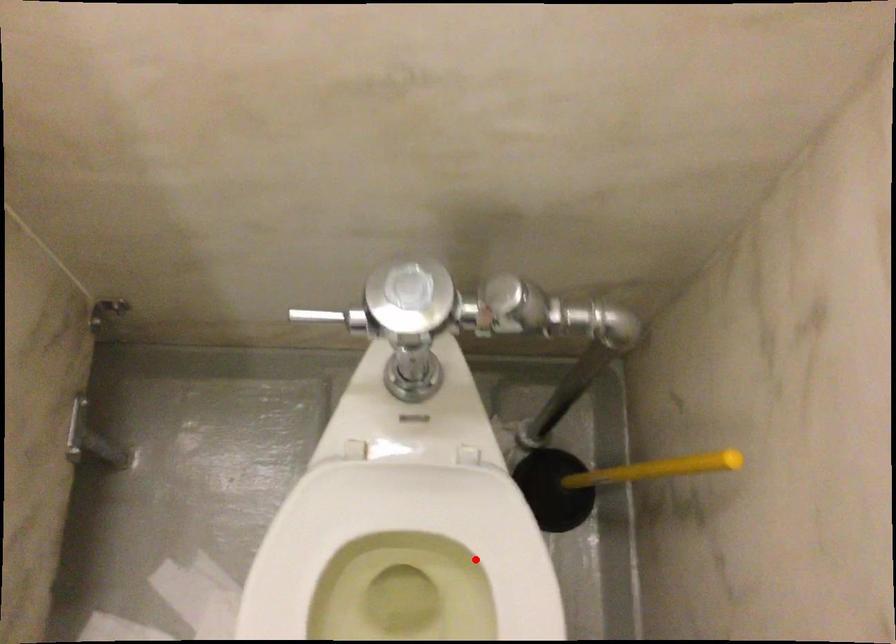
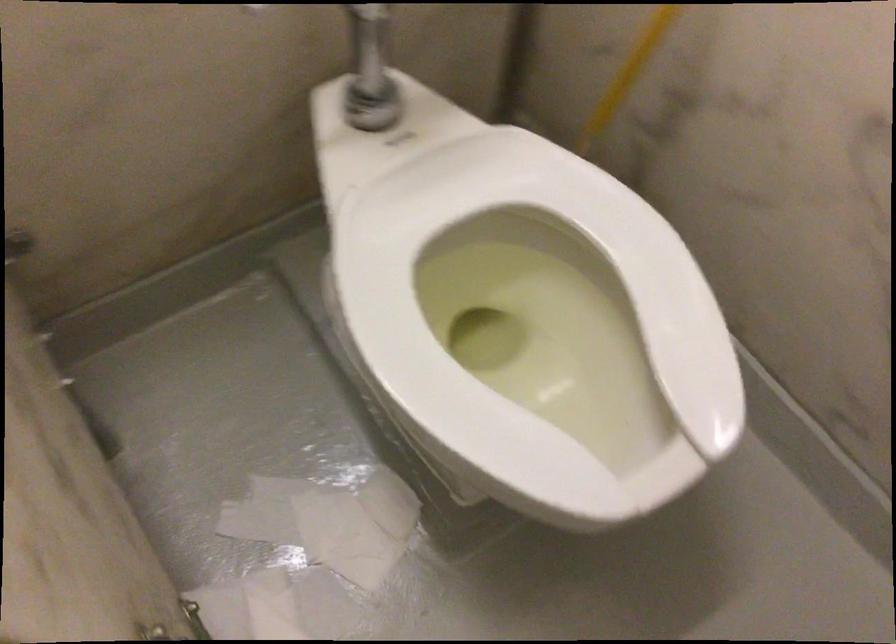
Locate, in the second image, the point that corresponds to the highlighted location in the first image.

(536, 254)